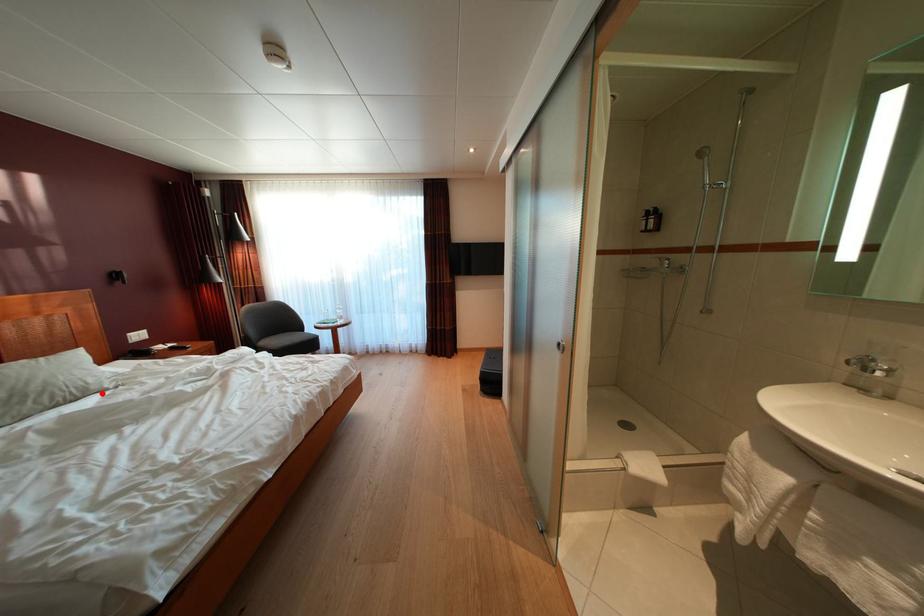
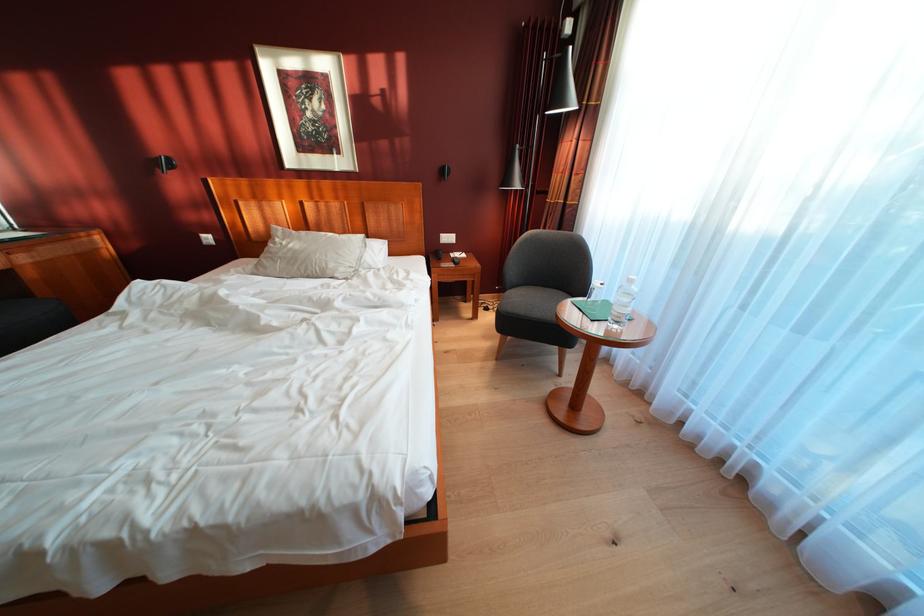
In the second image, find the point that corresponds to the highlighted location in the first image.

(336, 278)